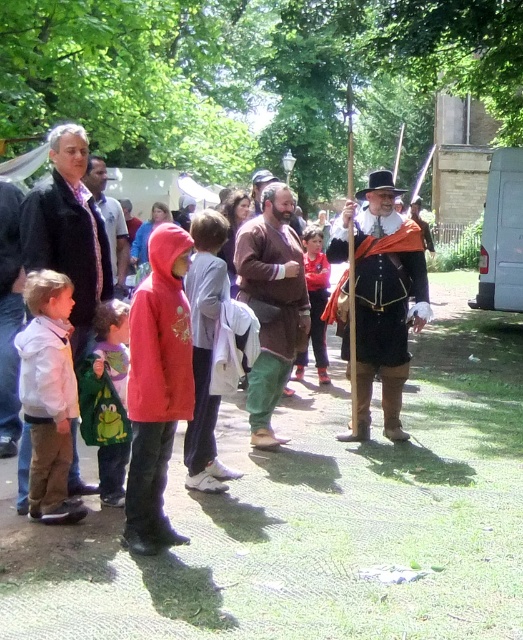
Between matte black coat at center and green fuzzy coat at lower left, which one is positioned lower?

green fuzzy coat at lower left is lower down.

Which is more to the right, matte black coat at center or green fuzzy coat at lower left?

matte black coat at center is more to the right.

The height and width of the screenshot is (640, 523). I want to click on matte black coat at center, so click(382, 298).

The width and height of the screenshot is (523, 640). In order to click on white matte shirt at left in this screenshot , I will do `click(49, 394)`.

Does white matte shirt at left appear over light gray hoodie at center?

No, white matte shirt at left is not above light gray hoodie at center.

Between point (40, 420) and point (210, 445), which one is positioned in front?

Point (40, 420) is more forward.

The width and height of the screenshot is (523, 640). What are the coordinates of `white matte shirt at left` in the screenshot? It's located at (49, 394).

Is matte black coat at center below dark gray jacket at center?

Yes.

Does point (380, 317) come behind point (63, 186)?

Yes, it is.

Is point (403, 296) farther from camera compared to point (69, 188)?

Yes, point (403, 296) is farther from viewer.

You are a GUI agent. You are given a task and a screenshot of the screen. Output one action in this format:
    pyautogui.click(x=<x>, y=<y>)
    Task: Click on the matte black coat at center
    The image size is (523, 640).
    Given the screenshot: What is the action you would take?
    pyautogui.click(x=382, y=298)